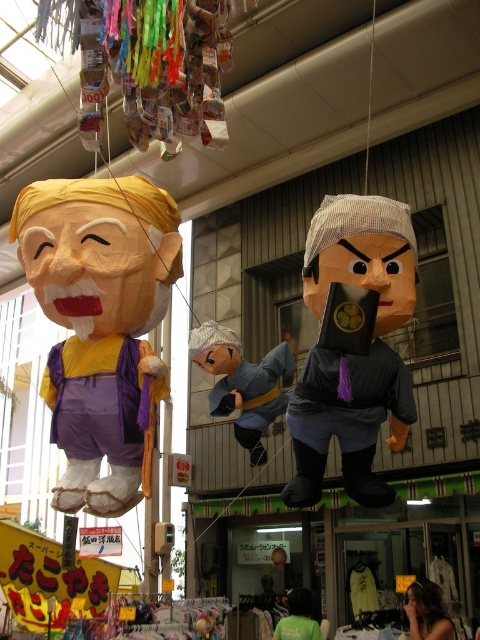
Can you confirm if matte yellow paper doll at left is smaller than matte gray fabric toy at center?

No.

Who is lower down, matte yellow paper doll at left or matte gray fabric toy at center?

Positioned lower is matte gray fabric toy at center.

Which is in front, point (88, 506) or point (219, 330)?

Point (88, 506)

Where is `matte yellow paper doll at left`? The height and width of the screenshot is (640, 480). matte yellow paper doll at left is located at coordinates (98, 259).

Does matte gray fabric toy at center have a smaller size compared to green fabric shirt at lower center?

No, matte gray fabric toy at center is not smaller than green fabric shirt at lower center.

Describe the element at coordinates (242, 384) in the screenshot. I see `matte gray fabric toy at center` at that location.

Is point (250, 426) less distant than point (311, 605)?

Yes, it is.

Where is `matte gray fabric toy at center`? matte gray fabric toy at center is located at coordinates (242, 384).

Is matte yellow paper doll at left thinner than matte gray fabric at center?

No.

Is matte yellow paper doll at left positioned in front of matte gray fabric at center?

That is False.

Is point (135, 218) in front of point (316, 452)?

Yes, it is in front of point (316, 452).

I want to click on matte yellow paper doll at left, so click(x=98, y=259).